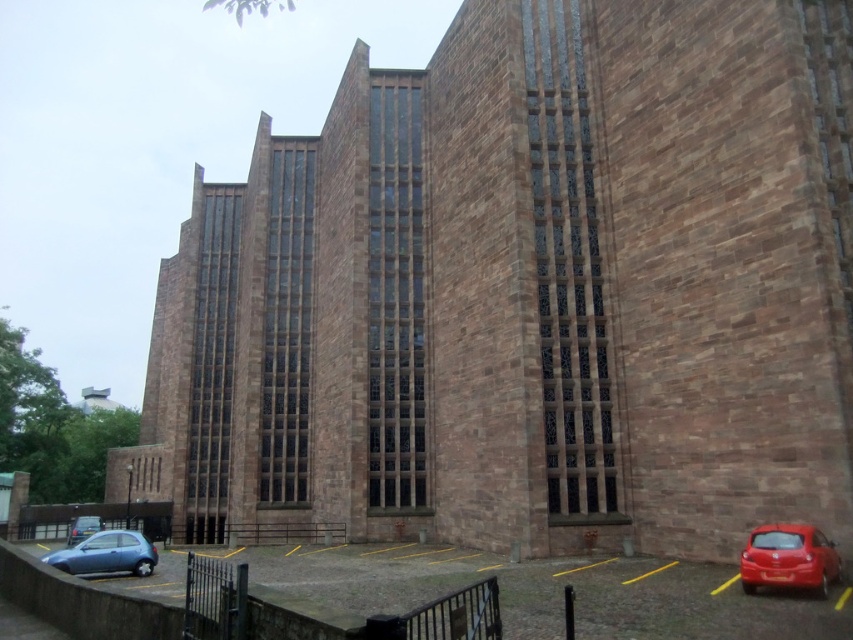
Describe the element at coordinates (788, 557) in the screenshot. Image resolution: width=853 pixels, height=640 pixels. I see `shiny red car at lower right` at that location.

Does point (790, 566) come closer to viewer compared to point (131, 532)?

That is True.

The height and width of the screenshot is (640, 853). What are the coordinates of `shiny red car at lower right` in the screenshot? It's located at (788, 557).

Can you confirm if smooth asphalt parking lot at lower center is shorter than metallic blue hatchback at lower left?

No, smooth asphalt parking lot at lower center is not shorter than metallic blue hatchback at lower left.

Is point (653, 621) farther from viewer compared to point (106, 561)?

No, it is not.

Locate an element on the screen. This screenshot has width=853, height=640. smooth asphalt parking lot at lower center is located at coordinates (546, 593).

Who is higher up, shiny red car at lower right or metallic silver car at lower left?

Positioned higher is shiny red car at lower right.

From the picture: Measure the distance between point (811, 529) and camera.

Point (811, 529) and camera are 109.00 feet apart.

At what (x,y) coordinates should I click in order to perform the action: click on shiny red car at lower right. Please return your answer as a coordinate pair (x, y). Looking at the image, I should click on pos(788,557).

This screenshot has height=640, width=853. Identify the location of shiny red car at lower right. (788, 557).